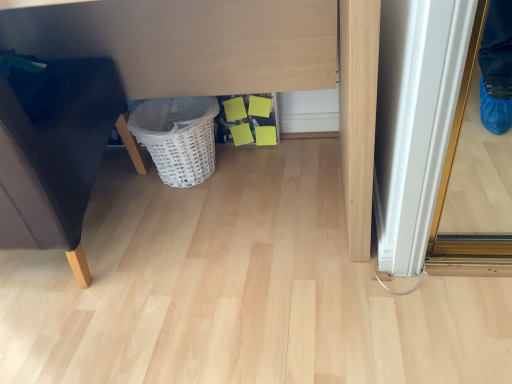
Question: Considering the positions of matte white vanity at center and white wicker basket at lower center in the image, is matte white vanity at center wider or thinner than white wicker basket at lower center?

Choices:
 (A) wide
 (B) thin

Answer: (A)

Question: Is matte white vanity at center to the left or to the right of white wicker basket at lower center in the image?

Choices:
 (A) left
 (B) right

Answer: (A)

Question: Which object is the closest to the matte white vanity at center?

Choices:
 (A) matte black sofa at left
 (B) white wicker basket at lower center

Answer: (B)

Question: Considering the real-world distances, which object is farthest from the white wicker basket at lower center?

Choices:
 (A) matte black sofa at left
 (B) matte white vanity at center

Answer: (A)